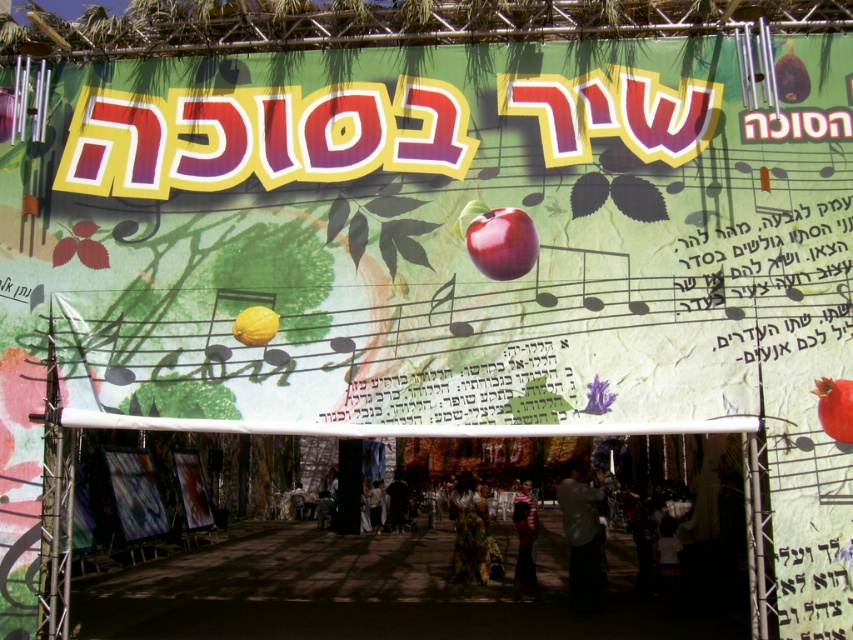
Question: Does yellow matte lemon at left appear over dark fabric person at center?

Choices:
 (A) no
 (B) yes

Answer: (B)

Question: Is shiny red apple at center further to camera compared to dark fabric person at center?

Choices:
 (A) no
 (B) yes

Answer: (A)

Question: Based on their relative distances, which object is farther from the shiny red apple at center?

Choices:
 (A) pomegranate at center
 (B) floral dress at center
 (C) dark gray shirt at center
 (D) dark fabric person at center

Answer: (D)

Question: Among these points, which one is farthest from the camera?

Choices:
 (A) (469, 518)
 (B) (527, 225)
 (C) (572, 520)

Answer: (A)

Question: Which object is closer to the camera taking this photo?

Choices:
 (A) shiny red apple at center
 (B) dark fabric person at center
 (C) dark gray shirt at center

Answer: (A)

Question: Is pomegranate at center wider than striped sweater at center?

Choices:
 (A) no
 (B) yes

Answer: (A)